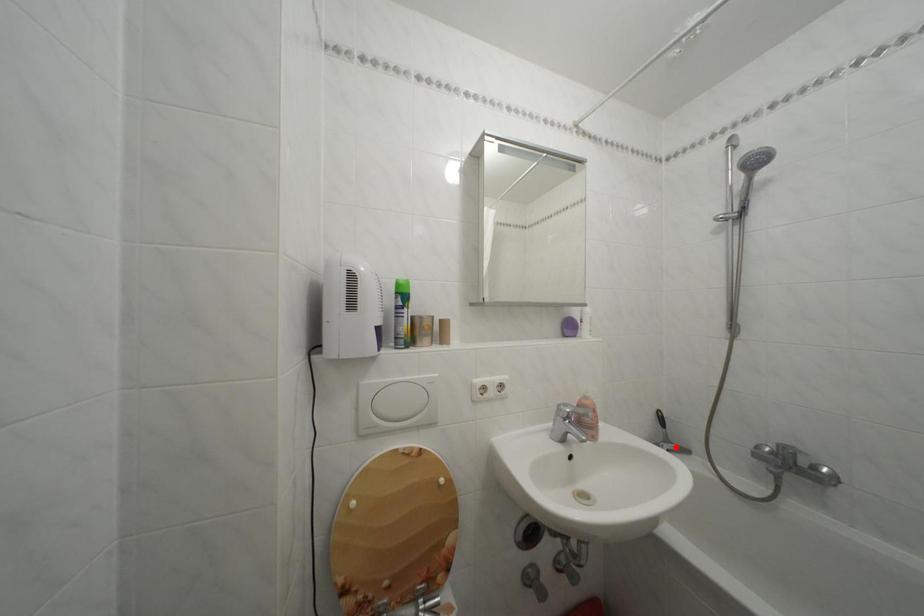
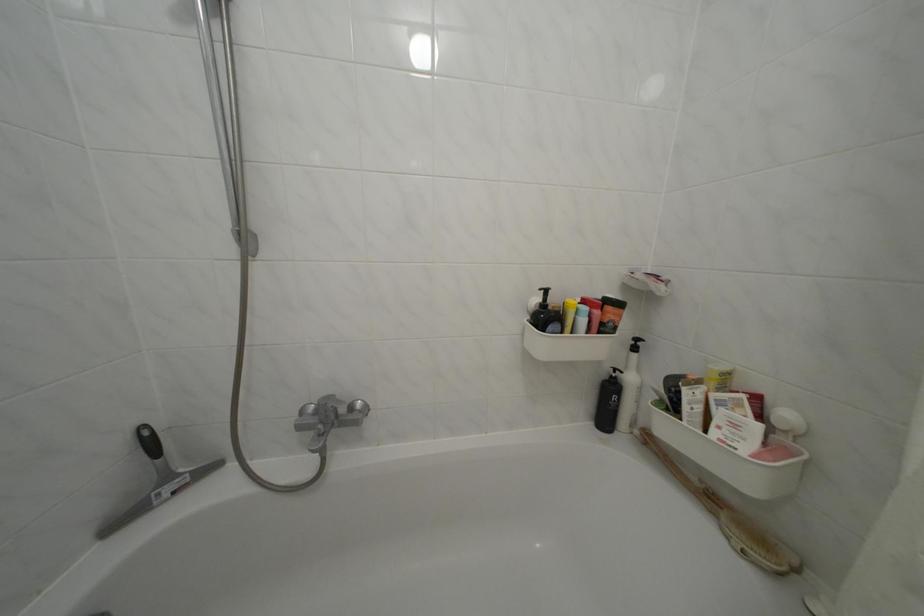
Where in the second image is the point corresponding to the highlighted location from the first image?

(176, 484)